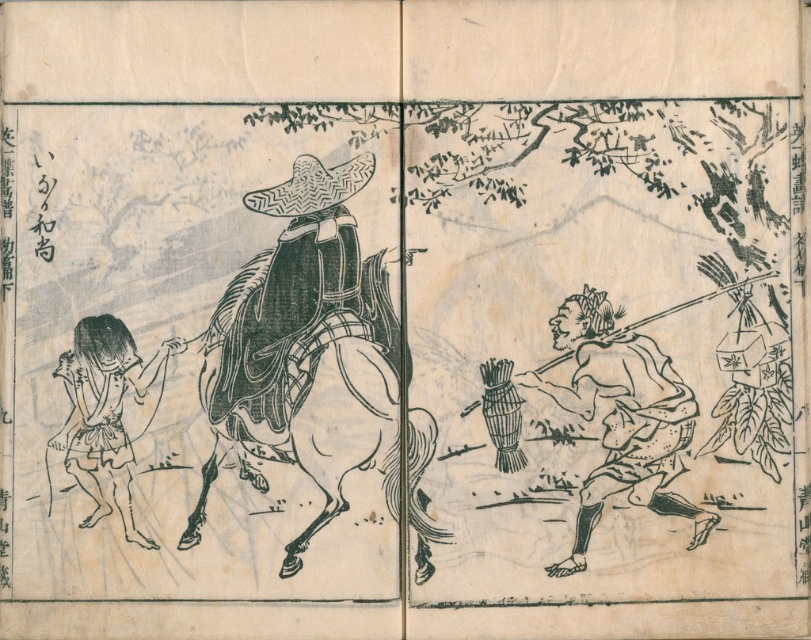
In the traditional Japanese woodblock print scene, you see a wooden staff at lower right and a black paper doll at lower left. Which object is wider?

The wooden staff at lower right is wider than the black paper doll at lower left.

You are an art conservator examining this traditional Japanese woodblock print. You notice the wooden staff at lower right and the woven straw hat at center. Based on their sizes in the artwork, which object would cast a longer shadow if sunlight were to hit them directly?

The wooden staff at lower right is larger in size compared to the woven straw hat at center, so it would cast a longer shadow.

In the scene shown: You are an art conservator examining this traditional Japanese woodblock print. You need to determine the spatial relationship between the wooden staff at lower right and the black paper doll at lower left. Which object is closer to the viewer?

The wooden staff at lower right is closer to the viewer than the black paper doll at lower left.